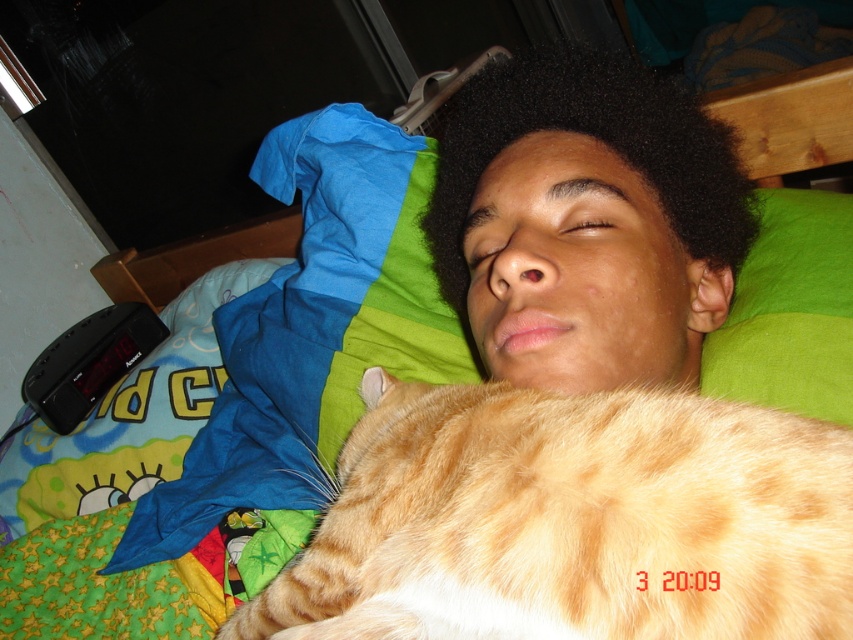
Does orange fur cat at center have a smaller size compared to black curly hair at center?

Indeed, orange fur cat at center has a smaller size compared to black curly hair at center.

From the picture: Is the position of orange fur cat at center more distant than that of black curly hair at center?

No, it is not.

This screenshot has width=853, height=640. What do you see at coordinates (572, 520) in the screenshot? I see `orange fur cat at center` at bounding box center [572, 520].

Locate an element on the screen. Image resolution: width=853 pixels, height=640 pixels. orange fur cat at center is located at coordinates (572, 520).